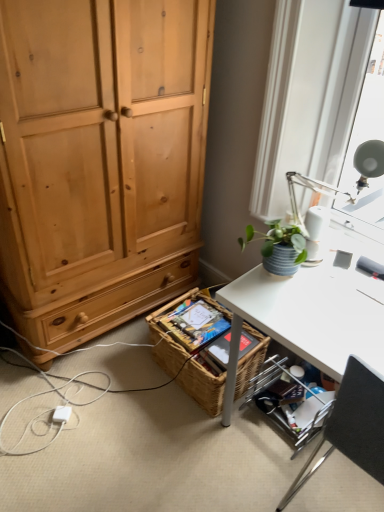
Question: Is white plastic power outlet at lower left smaller than metallic silver shelf at lower right?

Choices:
 (A) no
 (B) yes

Answer: (B)

Question: Is white plastic power outlet at lower left far away from metallic silver shelf at lower right?

Choices:
 (A) yes
 (B) no

Answer: (B)

Question: Is the depth of white plastic power outlet at lower left greater than that of metallic silver shelf at lower right?

Choices:
 (A) yes
 (B) no

Answer: (A)

Question: Considering the relative positions of white plastic power outlet at lower left and metallic silver shelf at lower right in the image provided, is white plastic power outlet at lower left to the right of metallic silver shelf at lower right from the viewer's perspective?

Choices:
 (A) no
 (B) yes

Answer: (A)

Question: Is white plastic power outlet at lower left oriented towards metallic silver shelf at lower right?

Choices:
 (A) no
 (B) yes

Answer: (A)

Question: Is point (59, 410) positioned closer to the camera than point (177, 361)?

Choices:
 (A) closer
 (B) farther

Answer: (A)

Question: Considering the positions of white plastic power outlet at lower left and woven brown picnic basket at lower center in the image, is white plastic power outlet at lower left bigger or smaller than woven brown picnic basket at lower center?

Choices:
 (A) big
 (B) small

Answer: (B)

Question: From their relative heights in the image, would you say white plastic power outlet at lower left is taller or shorter than woven brown picnic basket at lower center?

Choices:
 (A) short
 (B) tall

Answer: (A)

Question: Is white plastic power outlet at lower left wider or thinner than woven brown picnic basket at lower center?

Choices:
 (A) wide
 (B) thin

Answer: (B)

Question: From the image's perspective, is black fabric chair at lower right located above or below metallic silver shelf at lower right?

Choices:
 (A) below
 (B) above

Answer: (B)

Question: Is black fabric chair at lower right bigger or smaller than metallic silver shelf at lower right?

Choices:
 (A) small
 (B) big

Answer: (B)

Question: From a real-world perspective, is black fabric chair at lower right physically located above or below metallic silver shelf at lower right?

Choices:
 (A) below
 (B) above

Answer: (B)

Question: Based on their positions, is black fabric chair at lower right located to the left or right of metallic silver shelf at lower right?

Choices:
 (A) right
 (B) left

Answer: (A)

Question: In terms of width, does woven brown picnic basket at lower center look wider or thinner when compared to metallic silver shelf at lower right?

Choices:
 (A) wide
 (B) thin

Answer: (B)

Question: Looking at the image, does woven brown picnic basket at lower center seem bigger or smaller compared to metallic silver shelf at lower right?

Choices:
 (A) big
 (B) small

Answer: (A)